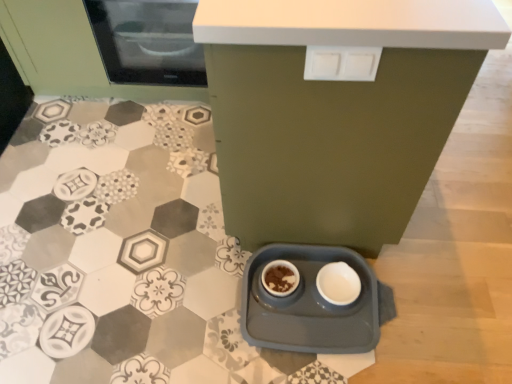
The height and width of the screenshot is (384, 512). Identify the location of free location to the right of gray plastic tray at lower center. (439, 299).